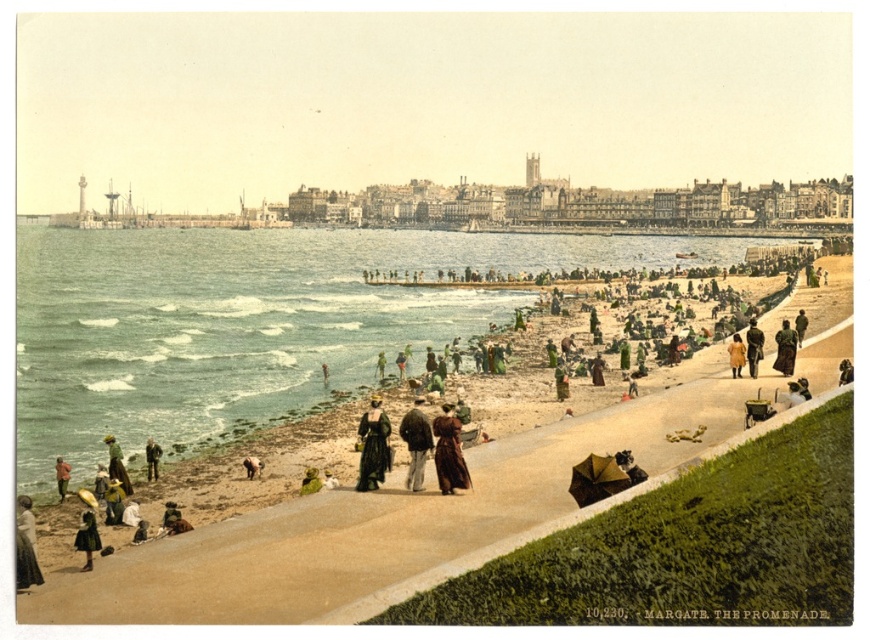
You are standing at the center of the pathway in the seaside promenade scene. You see a matte black dress at lower left. Where is the matte black dress located relative to your position?

The matte black dress at lower left is located at point 0.855 on the x axis and 0.030 on the y axis relative to the image frame.

You are a photographer standing at the edge of the pathway. You want to capture a photo that includes both the yellow fabric dress at lower right and the dark brown leather jacket at lower right. Which object should you position closer to the left side of your camera frame?

The yellow fabric dress at lower right should be positioned closer to the left side of your camera frame because it is located to the left of the dark brown leather jacket at lower right.

You are a photographer in the scene and want to capture both the matte black dress at lower left and the brown wool coat at lower right in your photo. Which object should you focus on first to ensure both are in frame?

The matte black dress at lower left has a lesser height compared to brown wool coat at lower right. To ensure both are in frame, focus on the taller brown wool coat at lower right first, then adjust to include the shorter matte black dress at lower left.